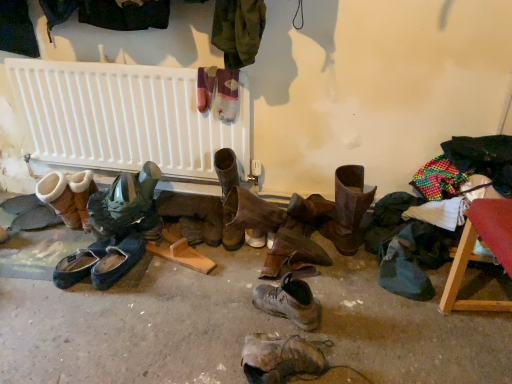
Question: Are leather boots at center, the 5th footwear when ordered from right to left, and white plastic radiator at upper center making contact?

Choices:
 (A) no
 (B) yes

Answer: (A)

Question: Is leather boots at center, the 5th footwear when ordered from right to left, smaller than white plastic radiator at upper center?

Choices:
 (A) yes
 (B) no

Answer: (A)

Question: Is leather boots at center, the 5th footwear when ordered from left to right, positioned behind white plastic radiator at upper center?

Choices:
 (A) no
 (B) yes

Answer: (B)

Question: Would you consider leather boots at center, the 5th footwear when ordered from right to left, to be distant from white plastic radiator at upper center?

Choices:
 (A) yes
 (B) no

Answer: (B)

Question: Is leather boots at center, the 5th footwear when ordered from left to right, aimed at white plastic radiator at upper center?

Choices:
 (A) yes
 (B) no

Answer: (B)

Question: Is leather boots at center, the 5th footwear when ordered from right to left, at the left side of white plastic radiator at upper center?

Choices:
 (A) no
 (B) yes

Answer: (A)

Question: Would you say leather boots at center, the 5th footwear when ordered from right to left, is part of brown leather boot at center, which appears as the ninth footwear when viewed from the left,'s contents?

Choices:
 (A) no
 (B) yes

Answer: (A)

Question: Is brown leather boot at center, which is the first footwear in right-to-left order, not within leather boots at center, the 5th footwear when ordered from left to right?

Choices:
 (A) no
 (B) yes

Answer: (B)

Question: Is brown leather boot at center, which appears as the ninth footwear when viewed from the left, next to leather boots at center, the 5th footwear when ordered from right to left, and touching it?

Choices:
 (A) yes
 (B) no

Answer: (B)

Question: From the image's perspective, is brown leather boot at center, which is the first footwear in right-to-left order, on top of leather boots at center, the 5th footwear when ordered from left to right?

Choices:
 (A) yes
 (B) no

Answer: (A)

Question: Is brown leather boot at center, which is the first footwear in right-to-left order, to the left of leather boots at center, the 5th footwear when ordered from right to left, from the viewer's perspective?

Choices:
 (A) yes
 (B) no

Answer: (B)

Question: From a real-world perspective, is brown leather boot at center, which is the first footwear in right-to-left order, over leather boots at center, the 5th footwear when ordered from left to right?

Choices:
 (A) no
 (B) yes

Answer: (B)

Question: Are suede/leather boot at left, which appears as the first footwear when viewed from the left, and leather boot at lower center, acting as the 3th footwear starting from the right, far apart?

Choices:
 (A) no
 (B) yes

Answer: (B)